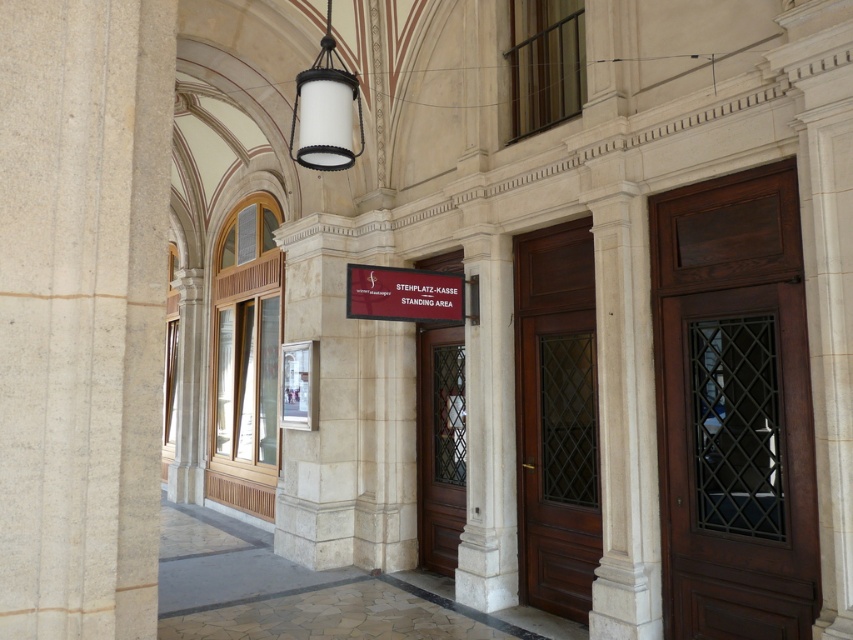
Who is shorter, white stone pillar at center or red matte sign at center?

red matte sign at center

Does white stone pillar at center lie behind red matte sign at center?

That is True.

Who is more forward, (300, 275) or (380, 292)?

Point (380, 292)

The height and width of the screenshot is (640, 853). In order to click on white stone pillar at center in this screenshot , I will do `click(322, 401)`.

Can you confirm if brown wooden door at center is positioned to the right of white matte lantern at upper center?

Indeed, brown wooden door at center is positioned on the right side of white matte lantern at upper center.

Who is shorter, brown wooden door at center or white matte lantern at upper center?

With less height is white matte lantern at upper center.

The image size is (853, 640). Describe the element at coordinates (440, 445) in the screenshot. I see `brown wooden door at center` at that location.

Find the location of `brown wooden door at center`. brown wooden door at center is located at coordinates (440, 445).

Find the location of a particular element. The height and width of the screenshot is (640, 853). mahogany wood door at center is located at coordinates (556, 419).

This screenshot has width=853, height=640. Describe the element at coordinates (556, 419) in the screenshot. I see `mahogany wood door at center` at that location.

Locate an element on the screen. The height and width of the screenshot is (640, 853). mahogany wood door at center is located at coordinates (556, 419).